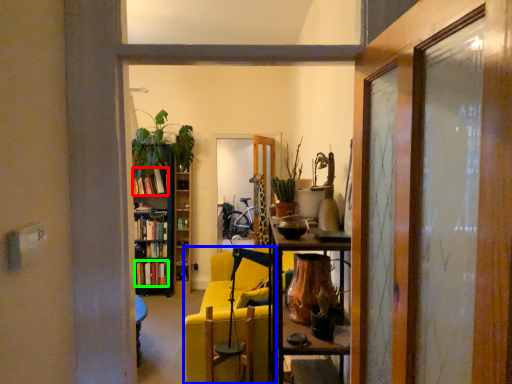
Question: Considering the real-world distances, which object is farthest from book (highlighted by a red box)? chair (highlighted by a blue box) or book (highlighted by a green box)?

Choices:
 (A) chair
 (B) book

Answer: (A)